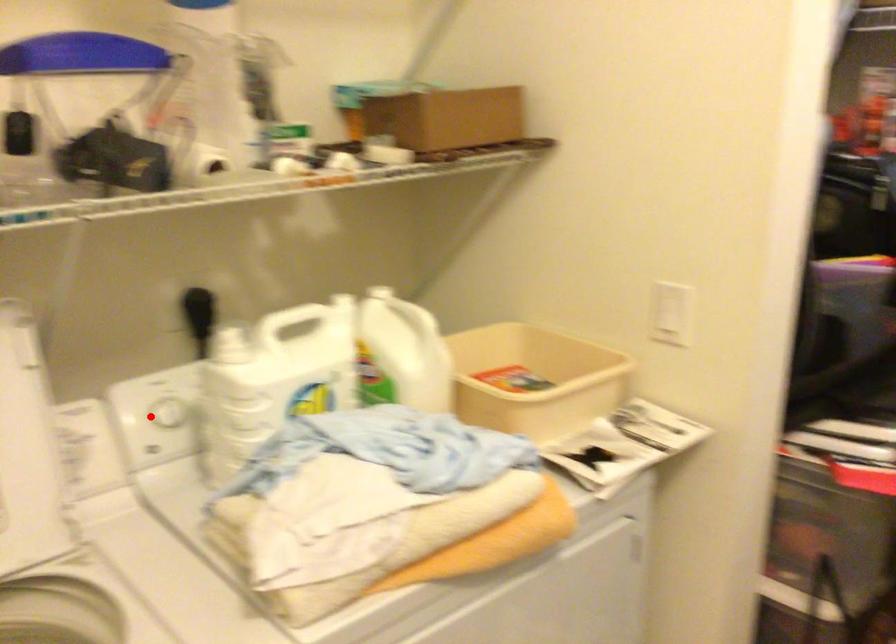
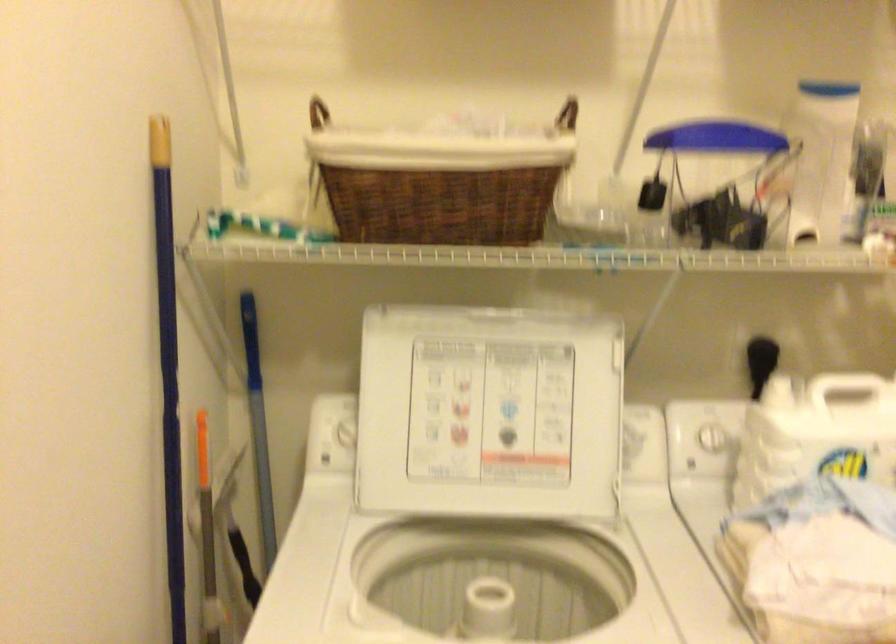
The point at the highlighted location is marked in the first image. Where is the corresponding point in the second image?

(698, 440)